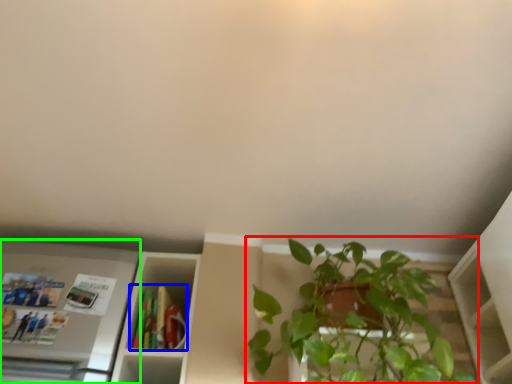
Question: Based on their relative distances, which object is farther from houseplant (highlighted by a red box)? Choose from book (highlighted by a blue box) and appliance (highlighted by a green box).

Choices:
 (A) book
 (B) appliance

Answer: (B)